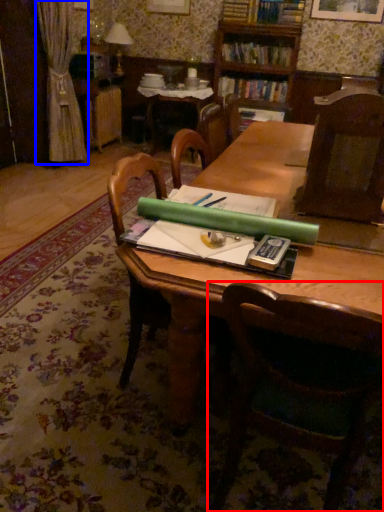
Question: Which of the following is the farthest to the observer, chair (highlighted by a red box) or curtain (highlighted by a blue box)?

Choices:
 (A) chair
 (B) curtain

Answer: (B)